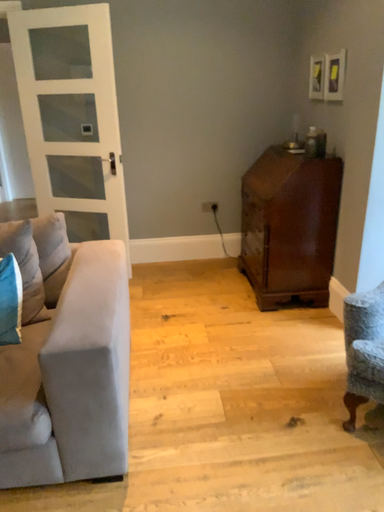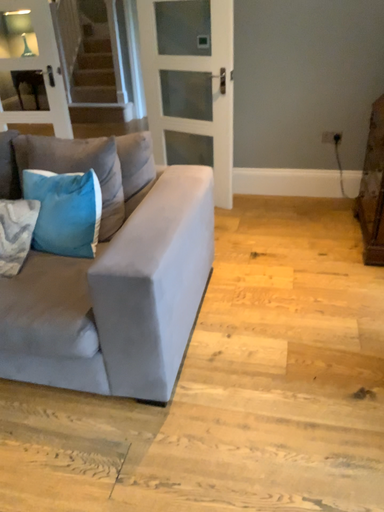
Question: How did the camera likely rotate when shooting the video?

Choices:
 (A) rotated left
 (B) rotated right

Answer: (A)